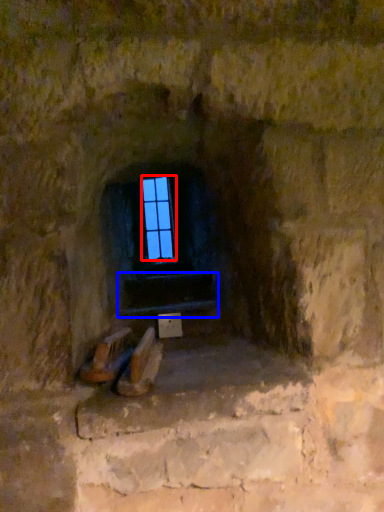
Question: Which object appears closest to the camera in this image, glass window (highlighted by a red box) or stairwell (highlighted by a blue box)?

Choices:
 (A) glass window
 (B) stairwell

Answer: (B)